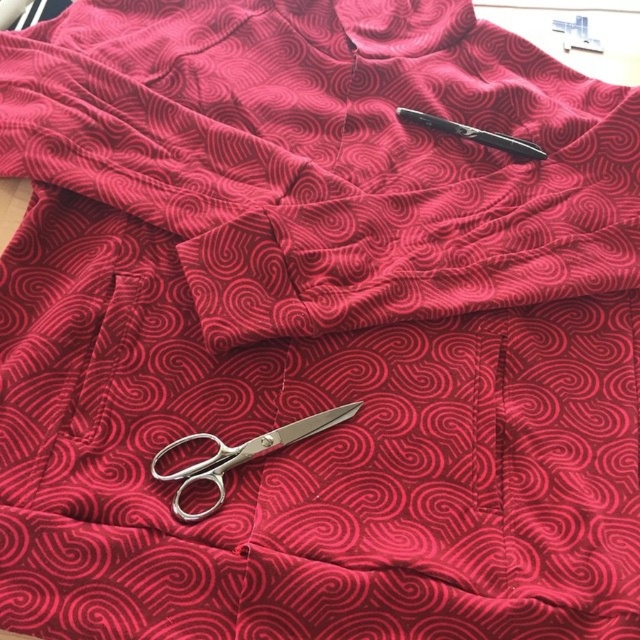
You are organizing a craft kit and need to place items on a red fabric with a swirling pattern. You have a pair of silver scissors and a black pen. The scissors are at point (176, 492) and the pen is at point (461, 125). If you want to place a new item between them, where should you position it relative to the scissors and the pen?

The new item should be placed between point (176, 492) and point (461, 125). Since point (176, 492) is in front of point (461, 125), the new item should be positioned closer to the scissors than the pen to maintain the spatial arrangement.

You are an artist working on a textile project. You need to place a new decorative pin exactly at the center of the fabric. The polished silver scissors at center are currently on the fabric. Where should you place the pin relative to the scissors?

The pin should be placed at the center of the fabric, which is different from the location of the polished silver scissors at center, since the scissors are at point (241, 456) and the center would be at point (320, 320).